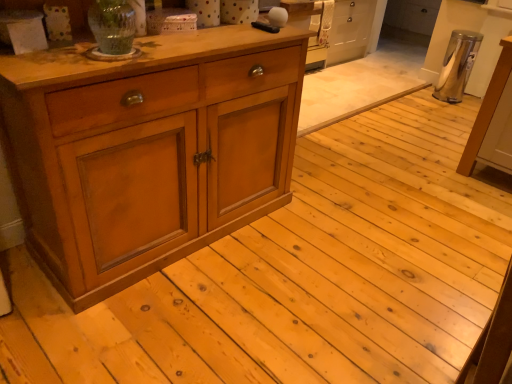
What do you see at coordinates (148, 150) in the screenshot?
I see `matte wood cabinet at center` at bounding box center [148, 150].

Locate an element on the screen. matte wood cabinet at center is located at coordinates (148, 150).

This screenshot has width=512, height=384. What are the coordinates of `matte wood cabinet at center` in the screenshot? It's located at (148, 150).